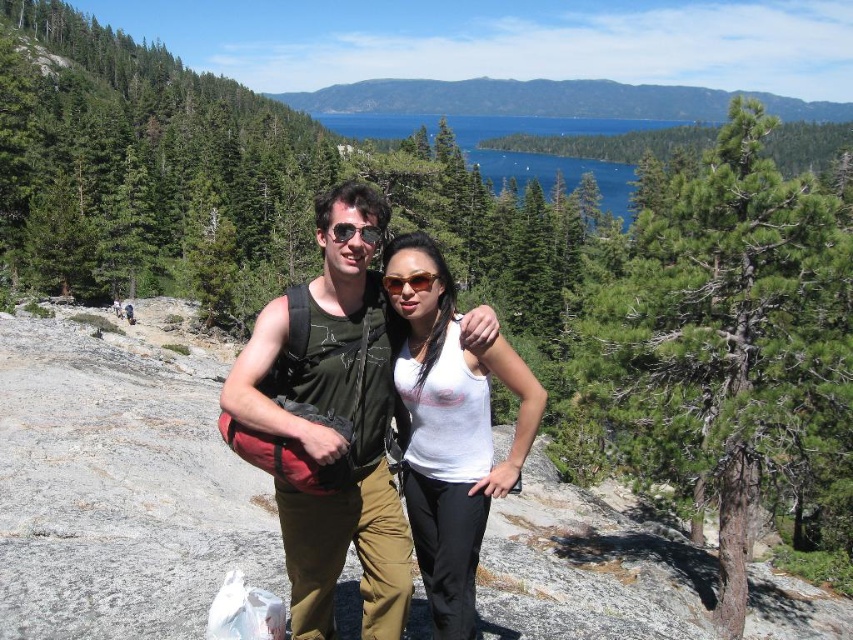
How distant is sunglasses at center from matte black sunglasses at center?

A distance of 63.11 centimeters exists between sunglasses at center and matte black sunglasses at center.

Which is more to the left, sunglasses at center or matte black sunglasses at center?

matte black sunglasses at center is more to the left.

Is point (387, 275) more distant than point (325, 230)?

Yes, it is behind point (325, 230).

Locate an element on the screen. The height and width of the screenshot is (640, 853). sunglasses at center is located at coordinates (409, 282).

From the picture: Is green forested mountain at upper center to the right of matte black sunglasses at center from the viewer's perspective?

Indeed, green forested mountain at upper center is positioned on the right side of matte black sunglasses at center.

Can you confirm if green forested mountain at upper center is bigger than matte black sunglasses at center?

Yes.

Who is more distant from viewer, [444,113] or [354,234]?

Positioned behind is point [444,113].

In order to click on green forested mountain at upper center in this screenshot , I will do `click(549, 99)`.

Which is below, green forested mountain at upper center or sunglasses at center?

Positioned lower is sunglasses at center.

Is point (296, 104) farther from camera compared to point (418, 282)?

That is True.

The image size is (853, 640). I want to click on green forested mountain at upper center, so click(549, 99).